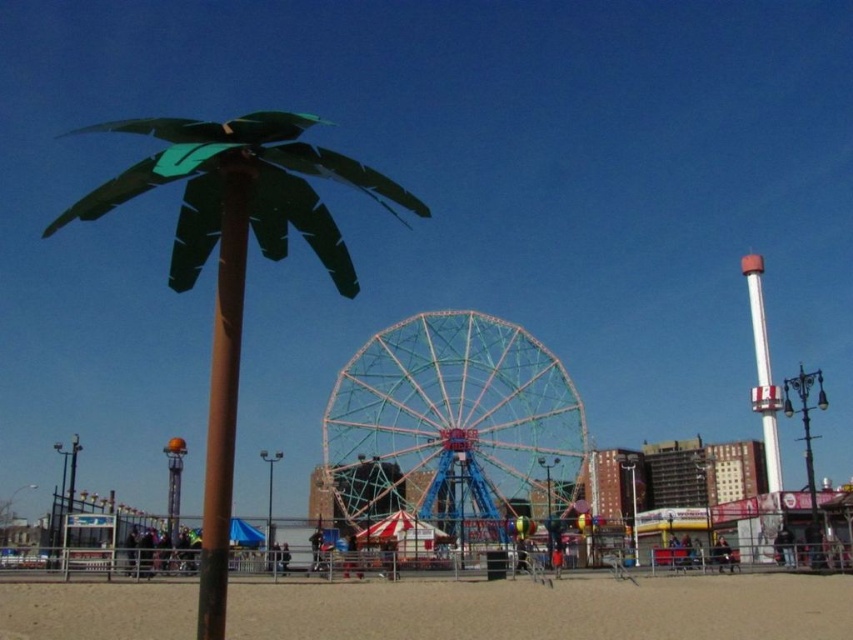
You are standing at the entrance of the amusement park and want to locate the metallic blue ferris wheel at center. According to the coordinates provided, where should you look?

You should look at point (451,426) to find the metallic blue ferris wheel at center.

You are a park visitor trying to decide between placing a picnic blanket under the metallic green palm tree at left or the brown matte pole at center. Which location offers more horizontal space for your blanket?

The metallic green palm tree at left is wider than the brown matte pole at center, so placing the picnic blanket under the metallic green palm tree at left would provide more horizontal space.

You are taking a photo of the amusement park scene. There are two points in the image labeled as point 1 and point 2. Point 1 is at coordinates point (x=234, y=285) and point 2 is at coordinates point (x=769, y=364). Which point is closer to the camera?

Point 1 is closer to the camera than point 2 because the description states that point (x=234, y=285) is closer to the camera than point (x=769, y=364).